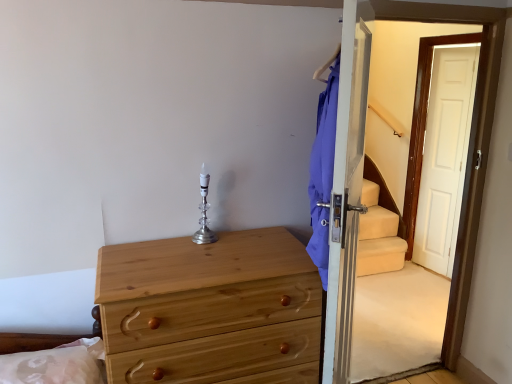
You are a GUI agent. You are given a task and a screenshot of the screen. Output one action in this format:
    pyautogui.click(x=<x>, y=<y>)
    Task: Click on the empty space that is ontop of natural wood chest of drawers at lower left (from a real-world perspective)
    The height and width of the screenshot is (384, 512).
    Given the screenshot: What is the action you would take?
    pyautogui.click(x=194, y=259)